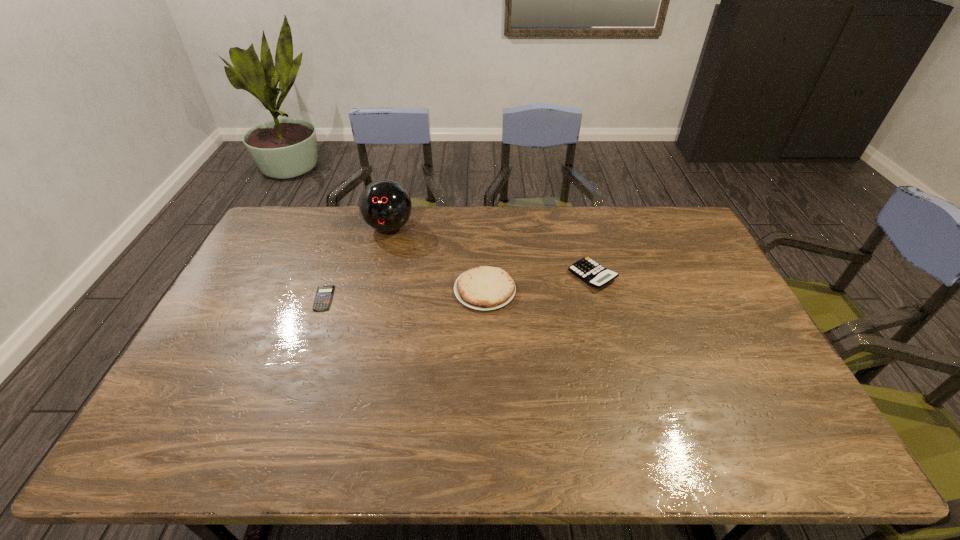
The width and height of the screenshot is (960, 540). I want to click on the farthest object, so click(384, 205).

Where is `the tallest object`? the tallest object is located at coordinates (384, 205).

Where is `the taller calculator`? The width and height of the screenshot is (960, 540). the taller calculator is located at coordinates (595, 275).

I want to click on the right calculator, so click(595, 275).

At what (x,y) coordinates should I click in order to perform the action: click on the third object from left to right. Please return your answer as a coordinate pair (x, y). The height and width of the screenshot is (540, 960). Looking at the image, I should click on (483, 288).

Image resolution: width=960 pixels, height=540 pixels. I want to click on the left calculator, so click(x=324, y=294).

Find the location of a particular element. The width and height of the screenshot is (960, 540). the shorter calculator is located at coordinates (324, 294).

Identify the location of vacant space located 0.090m on the surface of the bowling ball near the finger holes. This screenshot has width=960, height=540. (381, 259).

This screenshot has width=960, height=540. In order to click on vacant space located 0.300m on the front of the rightmost object in this screenshot , I will do `click(619, 374)`.

Where is `vacant space located on the left of the third object from left to right`? This screenshot has width=960, height=540. vacant space located on the left of the third object from left to right is located at coordinates (374, 290).